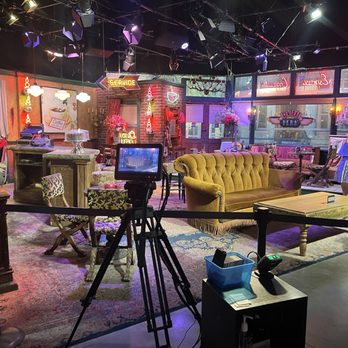
The width and height of the screenshot is (348, 348). In order to click on double door in this screenshot , I will do `click(194, 141)`, `click(211, 142)`.